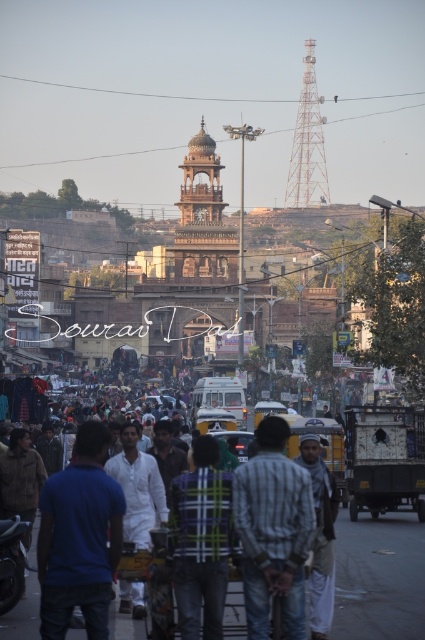
Does white cotton shirt at center have a lesser width compared to brown leather jacket at lower left?

No.

What do you see at coordinates (138, 488) in the screenshot?
I see `white cotton shirt at center` at bounding box center [138, 488].

The width and height of the screenshot is (425, 640). I want to click on white cotton shirt at center, so click(138, 488).

Is point (212, 323) positioned after point (99, 436)?

Yes, point (212, 323) is farther from viewer.

Does brown stone clock tower at center come behind blue cotton shirt at center?

Yes, it is.

Does point (257, 132) lie behind point (110, 525)?

Yes.

Where is `brown stone clock tower at center`? brown stone clock tower at center is located at coordinates [197, 259].

Between blue cotton shirt at center and blue plaid shirt at center, which one appears on the right side from the viewer's perspective?

Positioned to the right is blue plaid shirt at center.

Does blue cotton shirt at center appear on the right side of blue plaid shirt at center?

No, blue cotton shirt at center is not to the right of blue plaid shirt at center.

Who is more distant from viewer, (45,504) or (31,602)?

The point (31,602) is behind.

Locate an element on the screen. The height and width of the screenshot is (640, 425). blue cotton shirt at center is located at coordinates (79, 538).